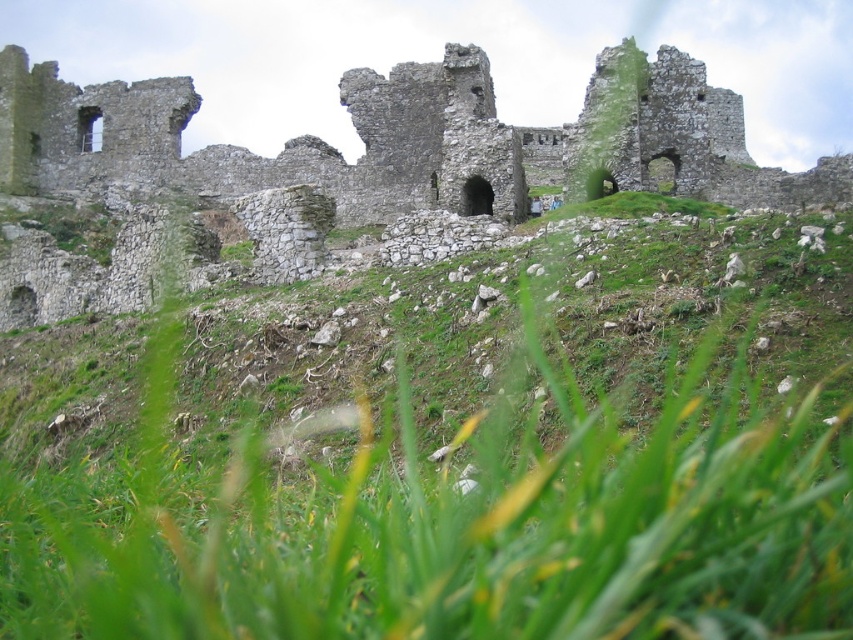
Is green grassy at center taller than stone ruins at upper center?

No, green grassy at center is not taller than stone ruins at upper center.

Which is more to the right, green grassy at center or stone ruins at upper center?

stone ruins at upper center is more to the right.

Which is in front, point (122, 461) or point (67, 310)?

Point (122, 461)

This screenshot has height=640, width=853. I want to click on green grassy at center, so click(x=445, y=454).